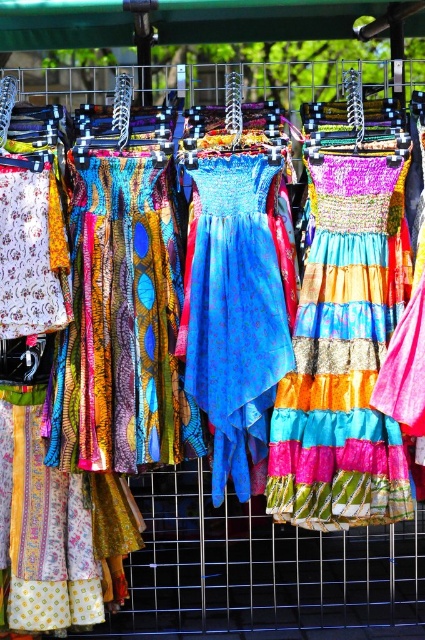
Is point (303, 371) farther from camera compared to point (227, 406)?

That is True.

Which of these two, shiny multicolored skirt at center or shiny blue fabric dress at center, stands taller?

shiny multicolored skirt at center

What do you see at coordinates (343, 355) in the screenshot? The image size is (425, 640). I see `shiny multicolored skirt at center` at bounding box center [343, 355].

Identify the location of shiny multicolored skirt at center. (343, 355).